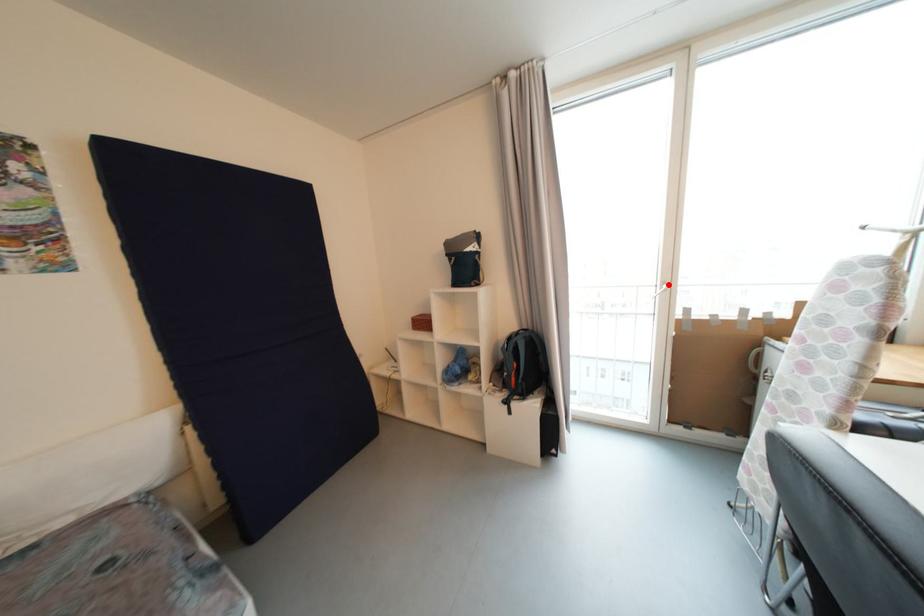
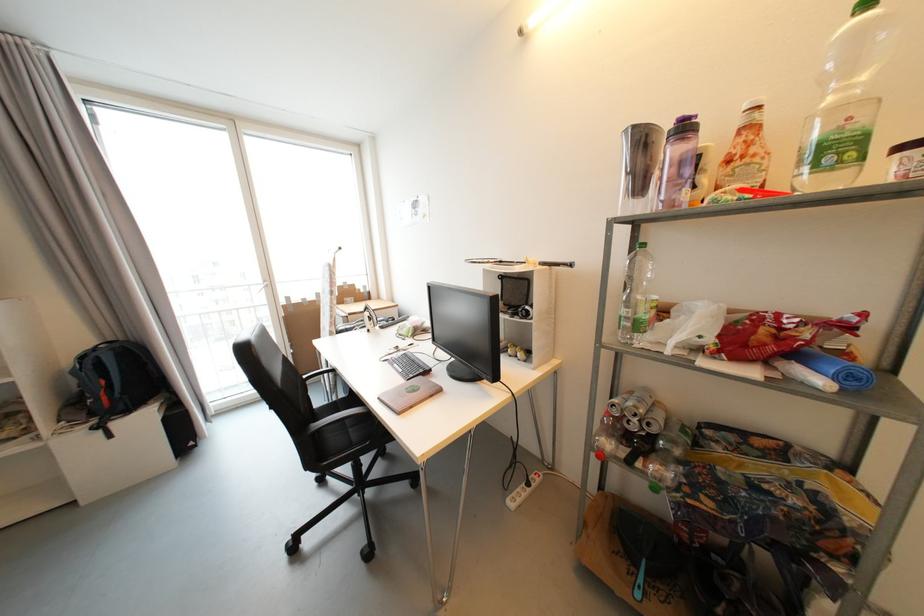
Where in the second image is the point corresponding to the highlighted location from the first image?

(271, 283)